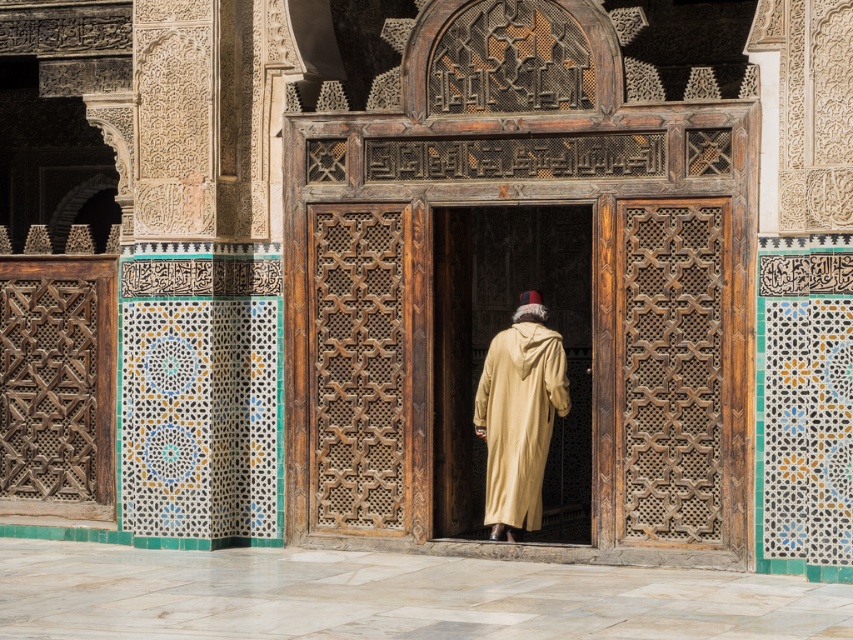
Who is more forward, (672,465) or (519,342)?

Point (672,465) is in front.

Who is positioned more to the right, wooden carved door at center or beige woolen robe at center?

Positioned to the right is wooden carved door at center.

Find the location of `wooden carved door at center`. wooden carved door at center is located at coordinates (521, 321).

Which is more to the right, wooden door at center or beige woolen robe at center?

Positioned to the right is wooden door at center.

Does wooden door at center have a greater width compared to beige woolen robe at center?

Incorrect, wooden door at center's width does not surpass beige woolen robe at center's.

The height and width of the screenshot is (640, 853). What are the coordinates of `wooden door at center` in the screenshot? It's located at (486, 348).

Is the position of wooden carved door at center more distant than that of wooden door at center?

That is False.

Which is behind, point (751, 125) or point (548, 260)?

Positioned behind is point (548, 260).

Where is `wooden carved door at center`? wooden carved door at center is located at coordinates (521, 321).